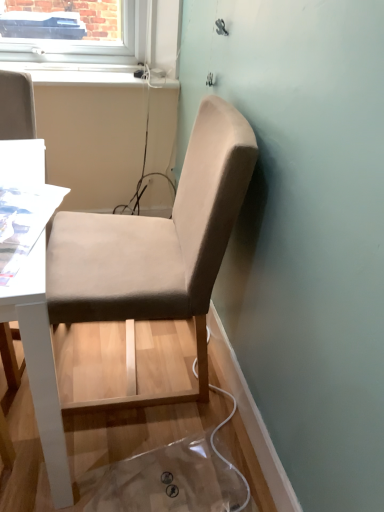
Where is `empty space that is ontop of white plastic window sill at upper center (from a real-world perspective)`? The width and height of the screenshot is (384, 512). empty space that is ontop of white plastic window sill at upper center (from a real-world perspective) is located at coordinates (88, 71).